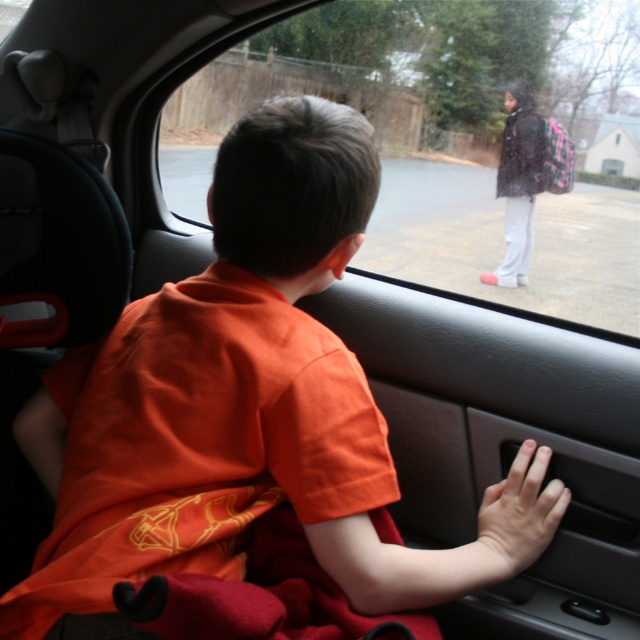
Locate an element on the screen. The width and height of the screenshot is (640, 640). transparent glass car window at center is located at coordinates (440, 145).

Does smooth skin hand at lower right appear under dark matte jacket at upper right?

Yes, smooth skin hand at lower right is below dark matte jacket at upper right.

I want to click on smooth skin hand at lower right, so 522,509.

Does black matte car door handle at lower right have a greater width compared to dark matte jacket at upper right?

Incorrect, black matte car door handle at lower right's width does not surpass dark matte jacket at upper right's.

Can you confirm if black matte car door handle at lower right is positioned above dark matte jacket at upper right?

Incorrect, black matte car door handle at lower right is not positioned above dark matte jacket at upper right.

Which is in front, point (474, 444) or point (506, 109)?

Point (474, 444) is more forward.

Locate an element on the screen. The image size is (640, 640). black matte car door handle at lower right is located at coordinates point(573,524).